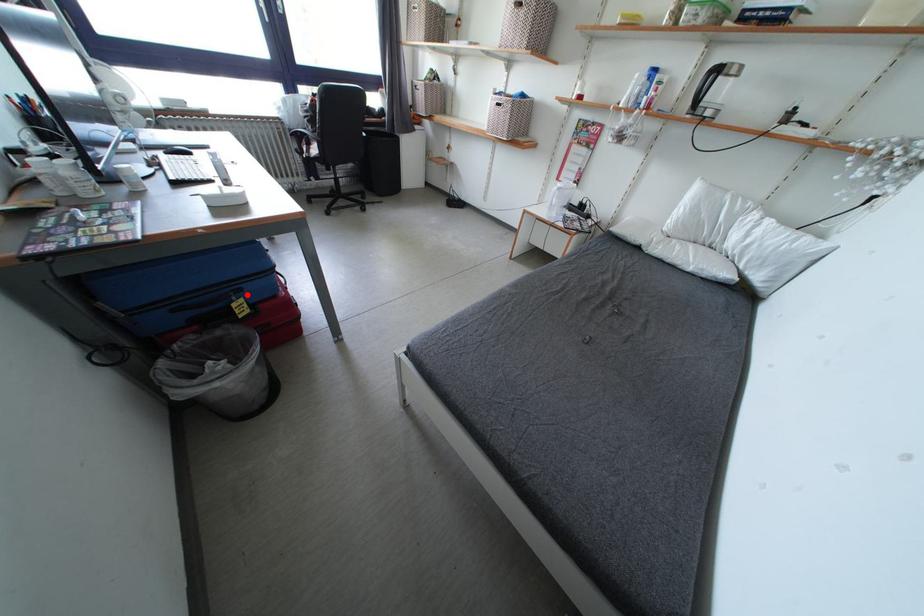
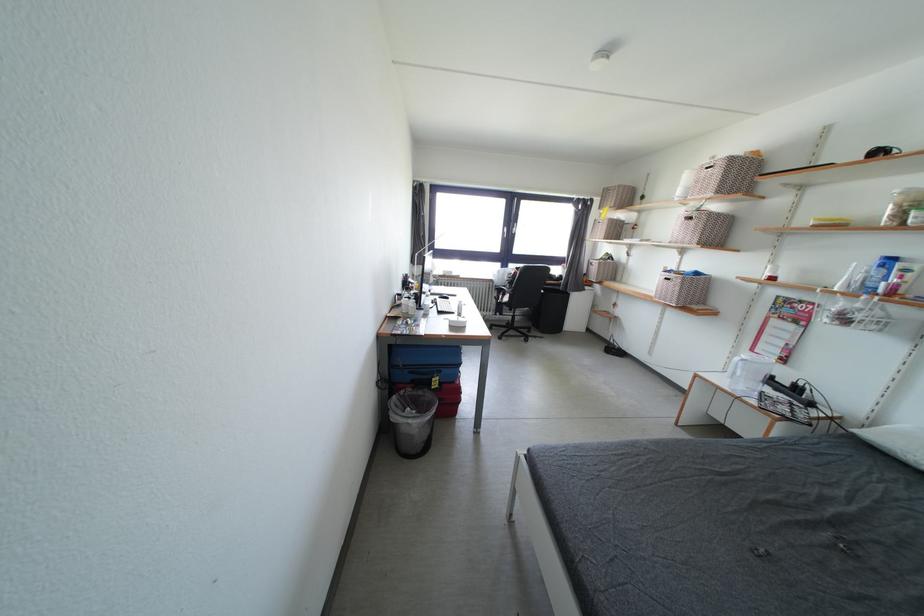
Question: I am providing you with two images of the same scene from different viewpoints. A red point is marked on the first image. At the location where the point appears in image 1, is it still visible in image 2?

Choices:
 (A) Yes
 (B) No

Answer: (A)